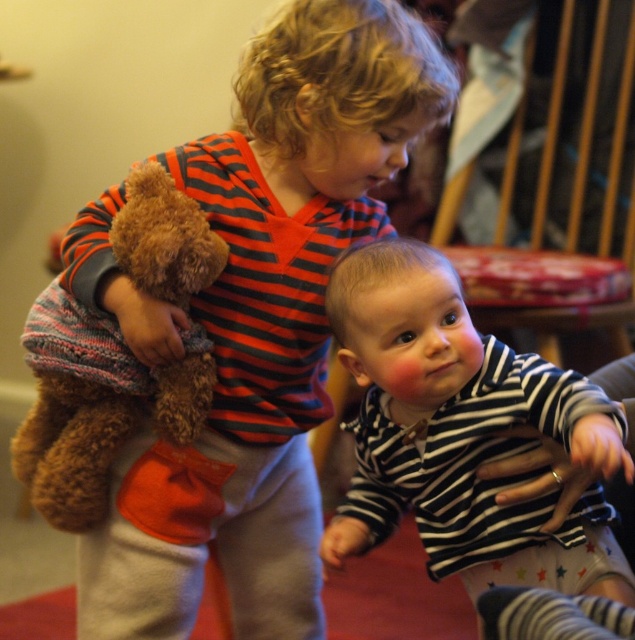
You are a photographer trying to capture the teddy bear in the center of the image. The image has a coordinate system where the bottom left corner is the origin point. The teddy bear is at point (265, 324). The photographer wants to adjust their camera to focus on the teddy bear. Which direction should the photographer move the camera to center the teddy bear?

The teddy bear is located at point (265, 324). Since the coordinate system has the bottom left corner as the origin, the X coordinate 0.508 indicates it is slightly to the right of the center horizontally, and the Y coordinate 0.419 means it is slightly below the center vertically. To center the teddy bear, the photographer should move the camera slightly to the left and upwards.

You are designing a display case for a childrens clothing store. The display case has a shelf that can only hold items up to 30 cm in width. You have a striped cotton shirt at center and a brown plush teddy bear at left. Based on their widths, which item can fit on the shelf?

The striped cotton shirt at center has a greater width than the brown plush teddy bear at left. Since the shelf can only hold items up to 30 cm, the brown plush teddy bear at left is narrower and would fit on the shelf, while the striped cotton shirt at center may exceed the width limit.

You are a toy organizer who needs to place the soft brown teddy bear at center and the brown plush teddy bear at left into storage boxes. The box for taller items is labeled with a red sticker. Which teddy bear should go into the red sticker box?

The soft brown teddy bear at center is taller than the brown plush teddy bear at left, so it should be placed in the red sticker box for taller items.